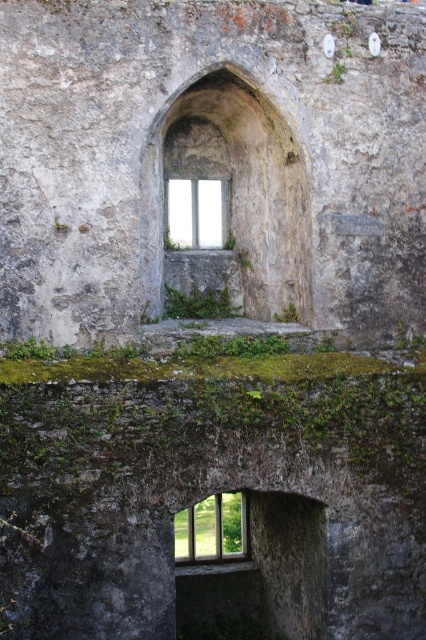
Question: In this image, where is clear glass window at center located relative to white glass window at upper center?

Choices:
 (A) right
 (B) left

Answer: (A)

Question: Can you confirm if clear glass window at center is smaller than white glass window at upper center?

Choices:
 (A) no
 (B) yes

Answer: (A)

Question: Which point appears closest to the camera in this image?

Choices:
 (A) (184, 532)
 (B) (189, 216)

Answer: (B)

Question: Which point is farther from the camera taking this photo?

Choices:
 (A) (204, 195)
 (B) (235, 515)

Answer: (B)

Question: Is clear glass window at center wider than white glass window at upper center?

Choices:
 (A) yes
 (B) no

Answer: (A)